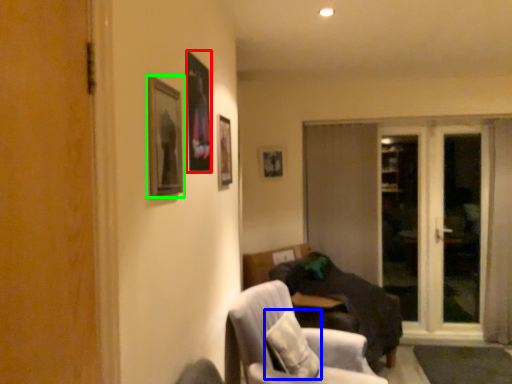
Question: Estimate the real-world distances between objects in this image. Which object is closer to picture frame (highlighted by a red box), pillow (highlighted by a blue box) or picture frame (highlighted by a green box)?

Choices:
 (A) pillow
 (B) picture frame

Answer: (B)